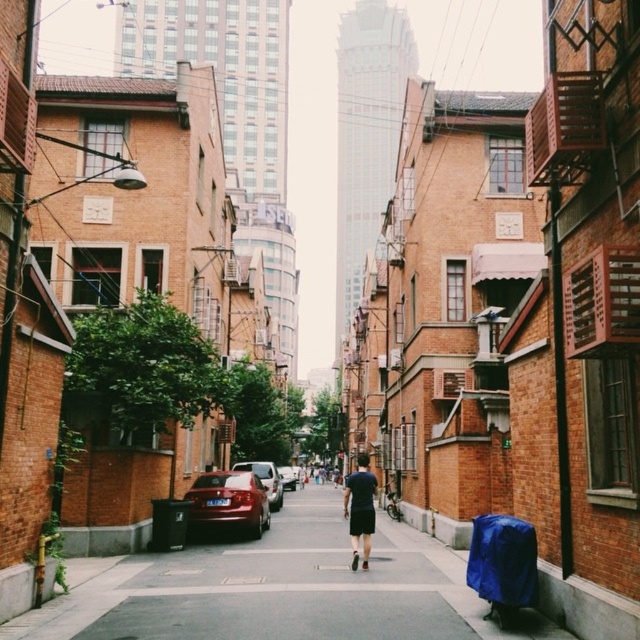
Which is more to the left, dark blue fabric shorts at center or shiny silver sedan at center?

Positioned to the left is shiny silver sedan at center.

This screenshot has width=640, height=640. I want to click on dark blue fabric shorts at center, so pos(358,508).

Which is in front, point (352, 474) or point (275, 476)?

Point (352, 474) is more forward.

Identify the location of dark blue fabric shorts at center. The width and height of the screenshot is (640, 640). (358, 508).

The width and height of the screenshot is (640, 640). In order to click on shiny red car at center in this screenshot , I will do `click(228, 500)`.

Is shiny red car at center wider than silver metallic sedan at center?

Correct, the width of shiny red car at center exceeds that of silver metallic sedan at center.

Which is behind, point (236, 474) or point (282, 483)?

Positioned behind is point (282, 483).

Identify the location of shiny red car at center. The width and height of the screenshot is (640, 640). pos(228,500).

Which is in front, point (262, 529) or point (280, 496)?

Point (262, 529) is in front.

Describe the element at coordinates (228, 500) in the screenshot. This screenshot has width=640, height=640. I see `shiny red car at center` at that location.

At what (x,y) coordinates should I click in order to perform the action: click on shiny red car at center. Please return your answer as a coordinate pair (x, y). The height and width of the screenshot is (640, 640). Looking at the image, I should click on click(228, 500).